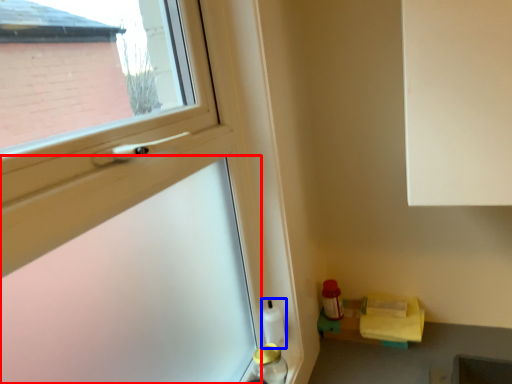
Question: Which of the following is the farthest to the observer, screen door (highlighted by a red box) or bottle (highlighted by a blue box)?

Choices:
 (A) screen door
 (B) bottle

Answer: (B)